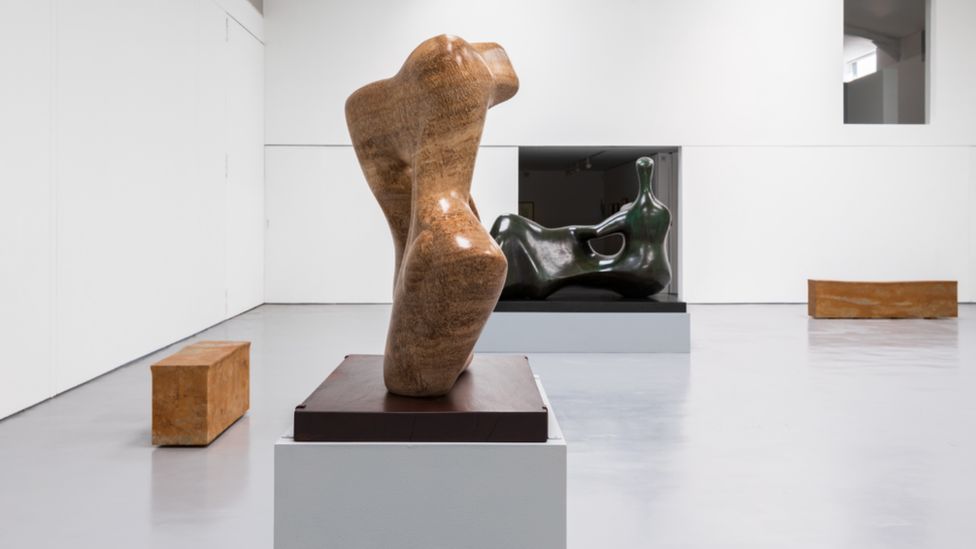
This screenshot has width=976, height=549. In order to click on hallway in this screenshot , I will do [x=573, y=186].